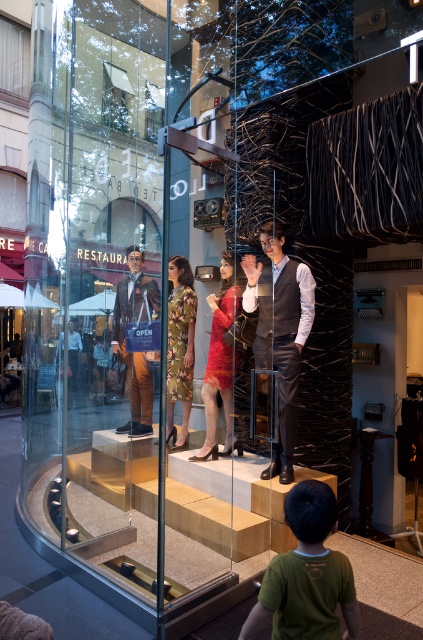
You are a customer looking at the storefront display. You see two items at the center of the display, the matte black vest at center and the matte brown suit at center. Which one is taller?

The matte black vest at center is taller than the matte brown suit at center.

You are a tailor trying to fit a customer who prefers slim fits. You have two options in the display case, the matte black vest at center and the matte brown suit at center. Which one would you recommend based on their slimness?

The matte black vest at center is thinner than the matte brown suit at center, so it would be the better recommendation for a slim fit.

You are a customer trying to decide between the matte black vest at center and the matte brown suit at center based on their sizes. Which one is smaller?

The matte black vest at center is smaller than the matte brown suit at center.